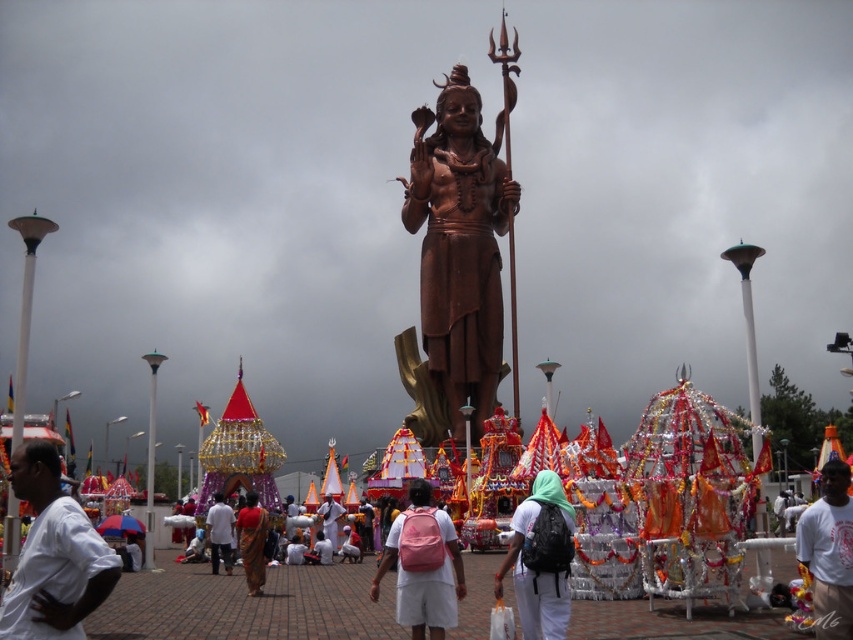
You are a photographer capturing the scene in front of the statue. You notice two people in the foreground wearing a matte red sari at center and a white cotton shirt at center. Which clothing item is positioned higher relative to the other?

The matte red sari at center is above the white cotton shirt at center, so the matte red sari at center is positioned higher.

You are a photographer planning to capture the golden statue of the deity in the background. You notice a white matte backpack at center and a pink fabric at center in the foreground. Which object should you adjust to avoid blocking the statue in your shot?

The white matte backpack at center is larger in size than the pink fabric at center, so adjusting the white matte backpack at center would be more effective in clearing the view of the statue.